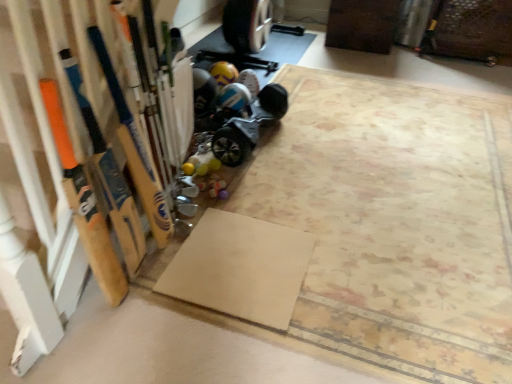
The width and height of the screenshot is (512, 384). In order to click on spots to the right of wooden baseball bat at left, the first baseball bat when ordered from left to right in this screenshot , I will do `click(144, 310)`.